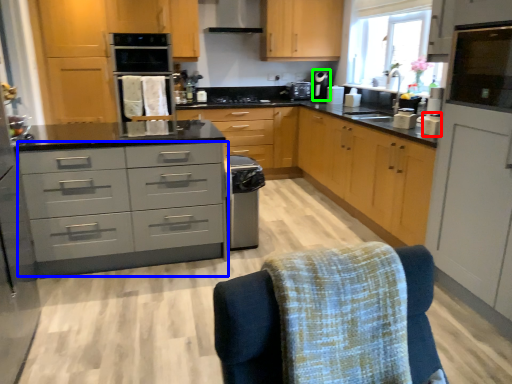
Question: Considering the real-world distances, which object is closest to appliance (highlighted by a red box)? chest of drawers (highlighted by a blue box) or coffee machine (highlighted by a green box).

Choices:
 (A) chest of drawers
 (B) coffee machine

Answer: (A)